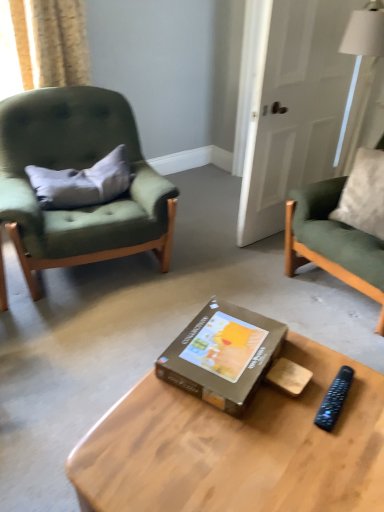
Find the location of `black plastic remote at lower right`. black plastic remote at lower right is located at coordinates (334, 399).

The image size is (384, 512). Find the location of `gray fabric pillow at left`. gray fabric pillow at left is located at coordinates (82, 182).

Locate an element on the screen. velvet green armchair at right, the 2th chair positioned from the left is located at coordinates (332, 241).

Describe the element at coordinates (332, 241) in the screenshot. This screenshot has width=384, height=512. I see `velvet green armchair at right, the first chair viewed from the right` at that location.

Find the location of a particular element. This screenshot has height=512, width=384. wooden coffee table at center is located at coordinates (238, 447).

Where is `white glossy door at upper right`? The width and height of the screenshot is (384, 512). white glossy door at upper right is located at coordinates (293, 108).

What do you see at coordinates (51, 42) in the screenshot? This screenshot has height=512, width=384. I see `light beige textured curtain at upper left` at bounding box center [51, 42].

Identify the location of black plastic remote at lower right. This screenshot has width=384, height=512. (334, 399).

Is green fabric chair at left, arranged as the second chair when viewed from the right, far away from gray fabric pillow at left?

They are positioned close to each other.

Who is bigger, green fabric chair at left, arranged as the second chair when viewed from the right, or gray fabric pillow at left?

green fabric chair at left, arranged as the second chair when viewed from the right.

Considering the sizes of green fabric chair at left, arranged as the 1th chair when viewed from the left, and gray fabric pillow at left in the image, is green fabric chair at left, arranged as the 1th chair when viewed from the left, wider or thinner than gray fabric pillow at left?

In the image, green fabric chair at left, arranged as the 1th chair when viewed from the left, appears to be wider than gray fabric pillow at left.

The image size is (384, 512). Find the location of `chair directly beneath the gray fabric pillow at left (from a real-world perspective)`. chair directly beneath the gray fabric pillow at left (from a real-world perspective) is located at coordinates (78, 168).

Is gray fabric pillow at left smaller than brown cardboard box at center?

No.

Is point (121, 164) positioned after point (229, 336)?

That is True.

I want to click on box that appears in front of the gray fabric pillow at left, so click(222, 355).

From the image's perspective, relative to brown cardboard box at center, is gray fabric pillow at left above or below?

From the image's perspective, gray fabric pillow at left appears above brown cardboard box at center.

Looking at this image, is wooden coffee table at center inside black plastic remote at lower right?

No, black plastic remote at lower right does not contain wooden coffee table at center.

Identify the location of remote control behind the wooden coffee table at center. The width and height of the screenshot is (384, 512). (334, 399).

Can you confirm if light beige textured curtain at upper left is bigger than brown cardboard box at center?

Correct, light beige textured curtain at upper left is larger in size than brown cardboard box at center.

Which is in front, light beige textured curtain at upper left or brown cardboard box at center?

brown cardboard box at center is more forward.

Does light beige textured curtain at upper left turn towards brown cardboard box at center?

Yes, light beige textured curtain at upper left is turned towards brown cardboard box at center.

Would you consider gray fabric pillow at left to be distant from black plastic remote at lower right?

That's right, there is a large distance between gray fabric pillow at left and black plastic remote at lower right.

From a real-world perspective, does gray fabric pillow at left stand above black plastic remote at lower right?

Yes, from a real-world perspective, gray fabric pillow at left is over black plastic remote at lower right

Is gray fabric pillow at left facing away from black plastic remote at lower right?

That's not correct — gray fabric pillow at left is not looking away from black plastic remote at lower right.

Does gray fabric pillow at left lie in front of black plastic remote at lower right?

No, gray fabric pillow at left is behind black plastic remote at lower right.

Find the location of a particular element. The image size is (384, 512). chair that is on the left side of brown cardboard box at center is located at coordinates (78, 168).

From the image's perspective, is green fabric chair at left, arranged as the second chair when viewed from the right, above or below brown cardboard box at center?

Based on their image positions, green fabric chair at left, arranged as the second chair when viewed from the right, is located above brown cardboard box at center.

Is green fabric chair at left, arranged as the 1th chair when viewed from the left, bigger or smaller than brown cardboard box at center?

green fabric chair at left, arranged as the 1th chair when viewed from the left, is bigger than brown cardboard box at center.

Considering the relative sizes of green fabric chair at left, arranged as the second chair when viewed from the right, and brown cardboard box at center in the image provided, is green fabric chair at left, arranged as the second chair when viewed from the right, wider than brown cardboard box at center?

Yes, green fabric chair at left, arranged as the second chair when viewed from the right, is wider than brown cardboard box at center.

Which object is closer to the camera, brown cardboard box at center or black plastic remote at lower right?

black plastic remote at lower right.

From the image's perspective, which one is positioned higher, brown cardboard box at center or black plastic remote at lower right?

brown cardboard box at center.

Is black plastic remote at lower right located within brown cardboard box at center?

No, black plastic remote at lower right is not a part of brown cardboard box at center.

Image resolution: width=384 pixels, height=512 pixels. In order to click on chair that is the 2nd object located in front of the gray fabric pillow at left in this screenshot , I will do `click(78, 168)`.

You are a GUI agent. You are given a task and a screenshot of the screen. Output one action in this format:
    pyautogui.click(x=<x>, y=<y>)
    Task: Click on the box on the right side of gray fabric pillow at left
    
    Given the screenshot: What is the action you would take?
    pyautogui.click(x=222, y=355)

Estimate the real-world distances between objects in this image. Which object is further from brown cardboard box at center, white glossy door at upper right or light beige textured curtain at upper left?

light beige textured curtain at upper left is further to brown cardboard box at center.

Which object lies further to the anchor point brown cardboard box at center, white glossy door at upper right or velvet green armchair at right, the first chair viewed from the right?

Result: white glossy door at upper right is further to brown cardboard box at center.

Considering their positions, is white glossy door at upper right positioned further to green fabric chair at left, arranged as the 1th chair when viewed from the left, than gray fabric pillow at left?

Based on the image, white glossy door at upper right appears to be further to green fabric chair at left, arranged as the 1th chair when viewed from the left.

Considering their positions, is brown cardboard box at center positioned closer to black plastic remote at lower right than white glossy door at upper right?

Among the two, brown cardboard box at center is located nearer to black plastic remote at lower right.

Estimate the real-world distances between objects in this image. Which object is further from light beige textured curtain at upper left, velvet green armchair at right, the 2th chair positioned from the left, or black plastic remote at lower right?

Among the two, black plastic remote at lower right is located further to light beige textured curtain at upper left.

Based on the photo, considering their positions, is black plastic remote at lower right positioned further to light beige textured curtain at upper left than white glossy door at upper right?

Based on the image, black plastic remote at lower right appears to be further to light beige textured curtain at upper left.

Estimate the real-world distances between objects in this image. Which object is closer to green fabric chair at left, arranged as the 1th chair when viewed from the left, velvet green armchair at right, the 2th chair positioned from the left, or light beige textured curtain at upper left?

light beige textured curtain at upper left is positioned closer to the anchor green fabric chair at left, arranged as the 1th chair when viewed from the left.

Which object lies nearer to the anchor point brown cardboard box at center, black plastic remote at lower right or velvet green armchair at right, the first chair viewed from the right?

black plastic remote at lower right.

This screenshot has height=512, width=384. Identify the location of box situated between green fabric chair at left, arranged as the second chair when viewed from the right, and velvet green armchair at right, the first chair viewed from the right, from left to right. point(222,355).

Locate an element on the screen. The image size is (384, 512). chair situated between light beige textured curtain at upper left and velvet green armchair at right, the first chair viewed from the right, from left to right is located at coordinates (78, 168).

Image resolution: width=384 pixels, height=512 pixels. I want to click on remote control between light beige textured curtain at upper left and wooden coffee table at center in the vertical direction, so click(x=334, y=399).

This screenshot has width=384, height=512. Find the location of `pillow between light beige textured curtain at upper left and velvet green armchair at right, the 2th chair positioned from the left, from left to right`. pillow between light beige textured curtain at upper left and velvet green armchair at right, the 2th chair positioned from the left, from left to right is located at coordinates (82, 182).